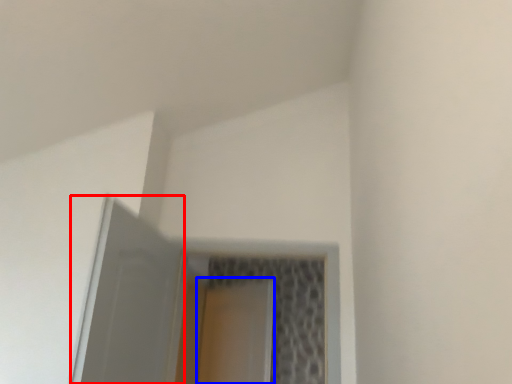
Question: Among these objects, which one is nearest to the camera, screen door (highlighted by a red box) or screen door (highlighted by a blue box)?

Choices:
 (A) screen door
 (B) screen door

Answer: (A)